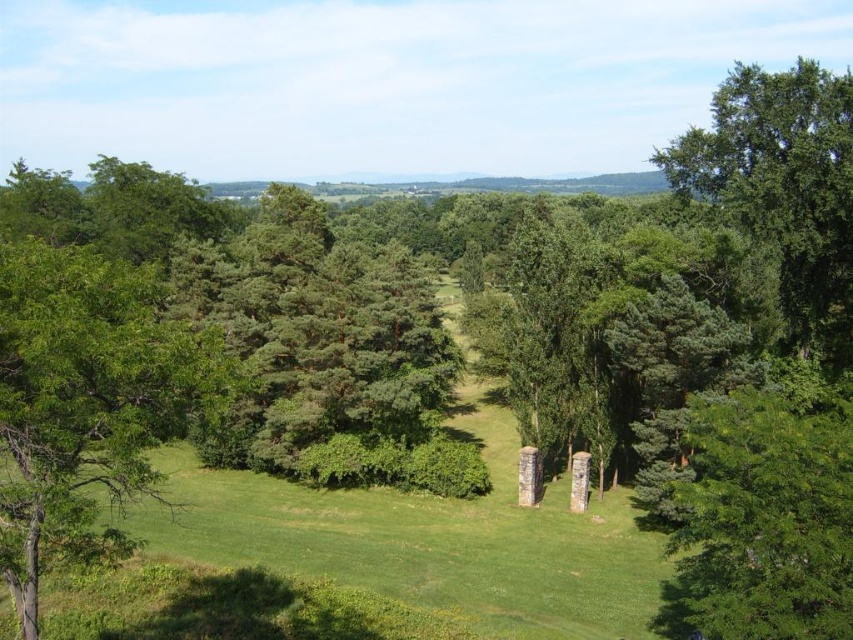
You are planning to plant a new tree in the grassy area between the green leafy tree at left and the stone structures in the midground. The new tree requires at least 10 meters of space between it and the nearest tree. Can you plant it there?

The distance between the green leafy tree at left and the stone structures in the midground is 15.29 meters. Since the new tree requires at least 10 meters of space, it can be planted there as the available space meets the requirement.

You are an explorer navigating through the landscape. You see the green leafy tree at left and the smooth stone pillar at center. Which object is located more to the left side of the scene?

The green leafy tree at left is positioned on the left side of the smooth stone pillar at center, so it is more to the left.

You are planning to place a picnic blanket between the green leafy tree at left and the smooth stone pillar at center. Which object should you position the blanket closer to if you want to maximize the space available for the blanket?

You should position the picnic blanket closer to the smooth stone pillar at center because the green leafy tree at left might be wider than the smooth stone pillar at center, leaving more space between the pillar and the tree.